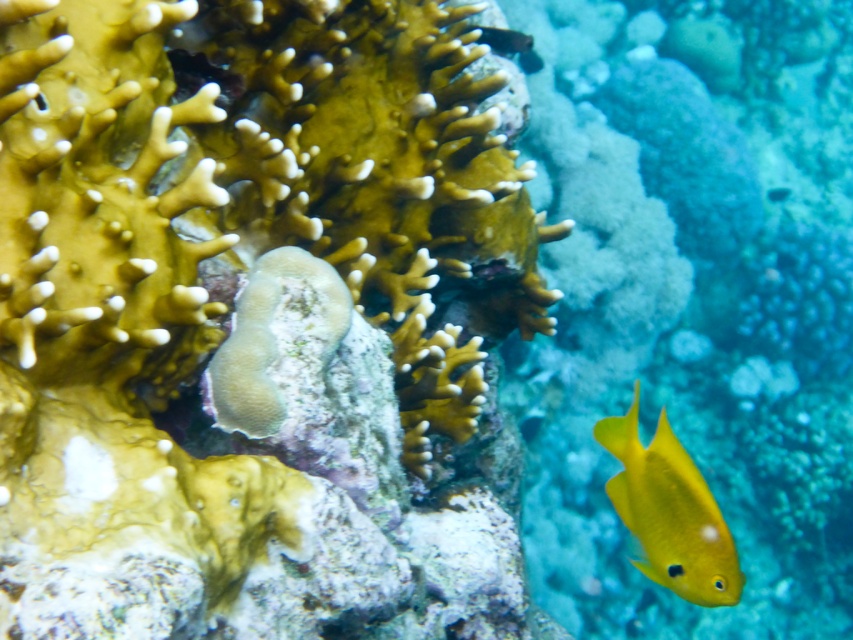
Question: Among these objects, which one is farthest from the camera?

Choices:
 (A) yellow matte fish at right
 (B) smooth yellow coral at center

Answer: (A)

Question: Among these points, which one is nearest to the camera?

Choices:
 (A) (625, 468)
 (B) (57, 545)

Answer: (B)

Question: Is the position of smooth yellow coral at center more distant than that of yellow matte fish at right?

Choices:
 (A) no
 (B) yes

Answer: (A)

Question: Is smooth yellow coral at center wider than yellow matte fish at right?

Choices:
 (A) yes
 (B) no

Answer: (A)

Question: From the image, what is the correct spatial relationship of smooth yellow coral at center in relation to yellow matte fish at right?

Choices:
 (A) below
 (B) above

Answer: (B)